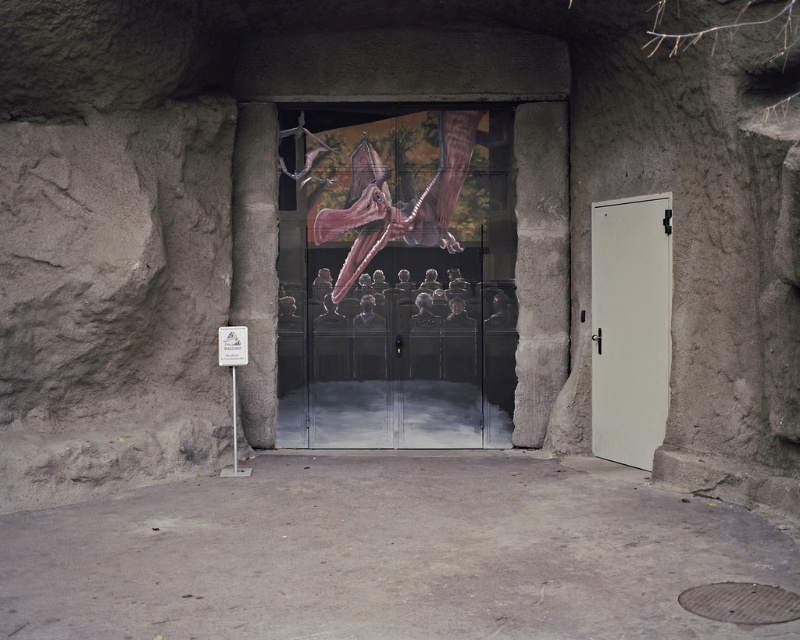
What is the spatial relationship between the transparent glass doors at center and the white matte door at right in the cave entrance?

The transparent glass doors at center are positioned to the left of the white matte door at right.

You are a visitor at the entrance of this cave structure. You need to enter through one of the doors. The transparent glass doors at center show the interior through their transparency, while the white matte door at right obscures the view. Considering their heights, which door would allow you to see more of the interior ceiling when standing at the entrance?

The transparent glass doors at center are much taller than the white matte door at right, so they would allow you to see more of the interior ceiling when standing at the entrance.